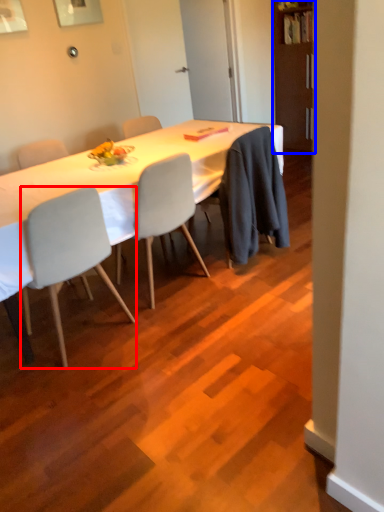
Question: Which object appears farthest to the camera in this image, chair (highlighted by a red box) or bookshelf (highlighted by a blue box)?

Choices:
 (A) chair
 (B) bookshelf

Answer: (B)